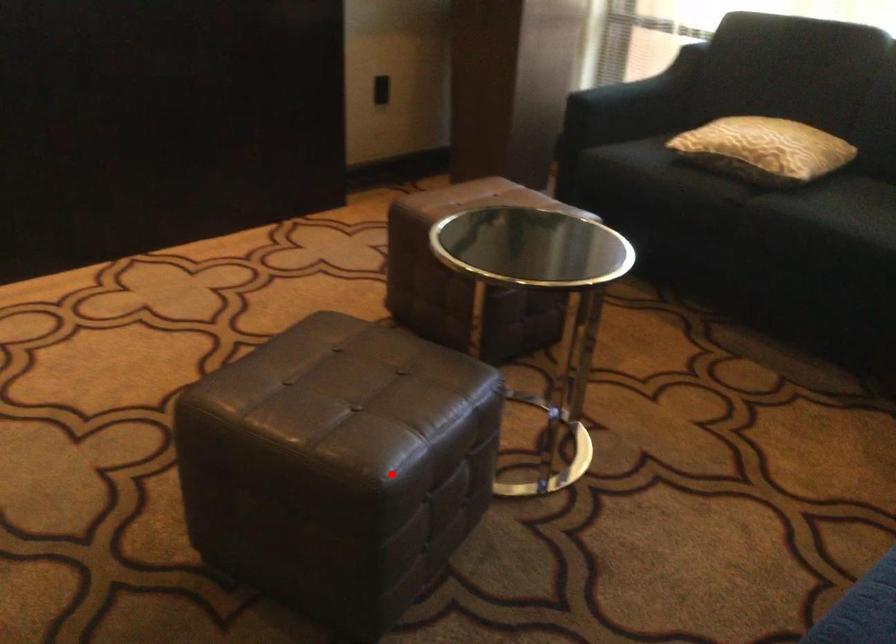
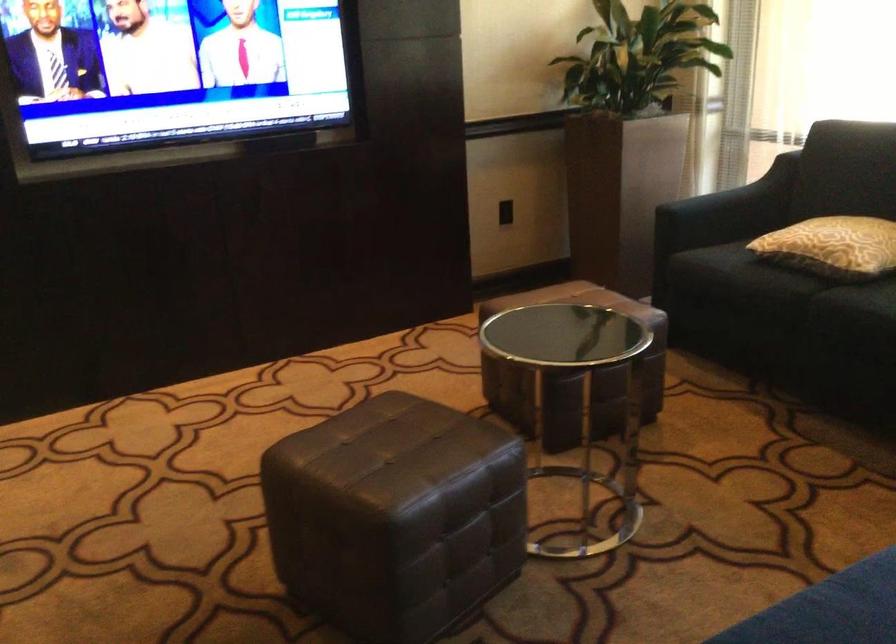
Locate, in the second image, the point that corresponds to the highlighted location in the first image.

(394, 516)